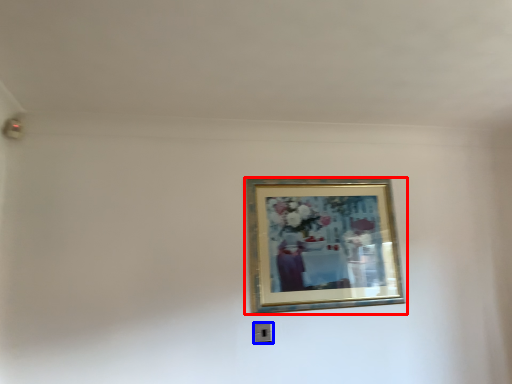
Question: Among these objects, which one is farthest to the camera, picture frame (highlighted by a red box) or electric outlet (highlighted by a blue box)?

Choices:
 (A) picture frame
 (B) electric outlet

Answer: (B)